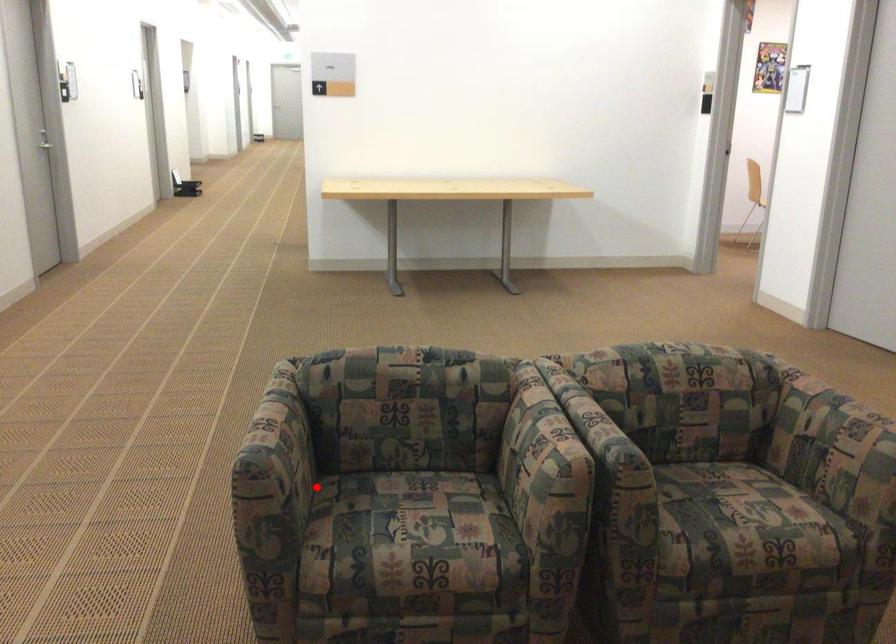
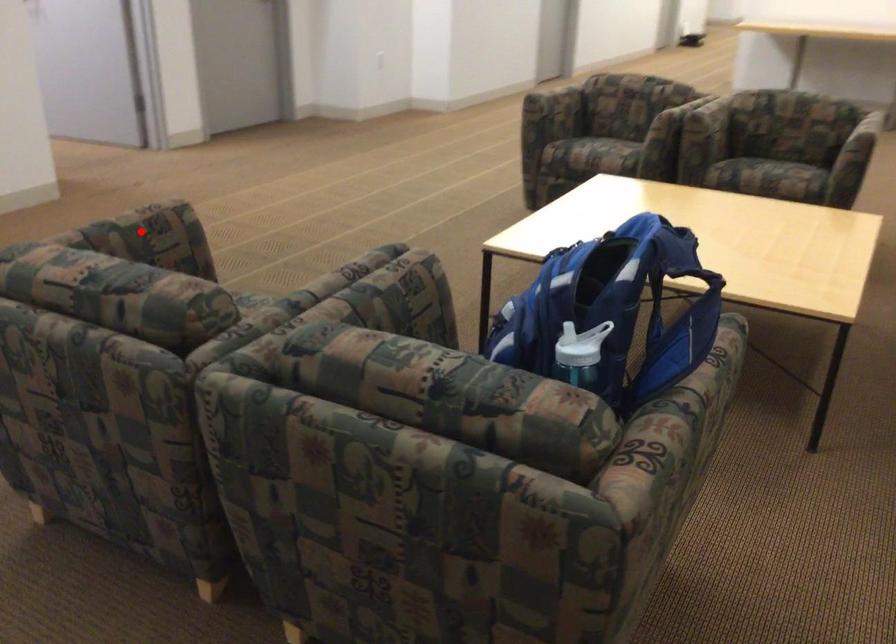
I am providing you with two images of the same scene from different viewpoints. A red point is marked on the first image and another point is marked on the second image. Are the points marked in image1 and image2 representing the same 3D position?

No